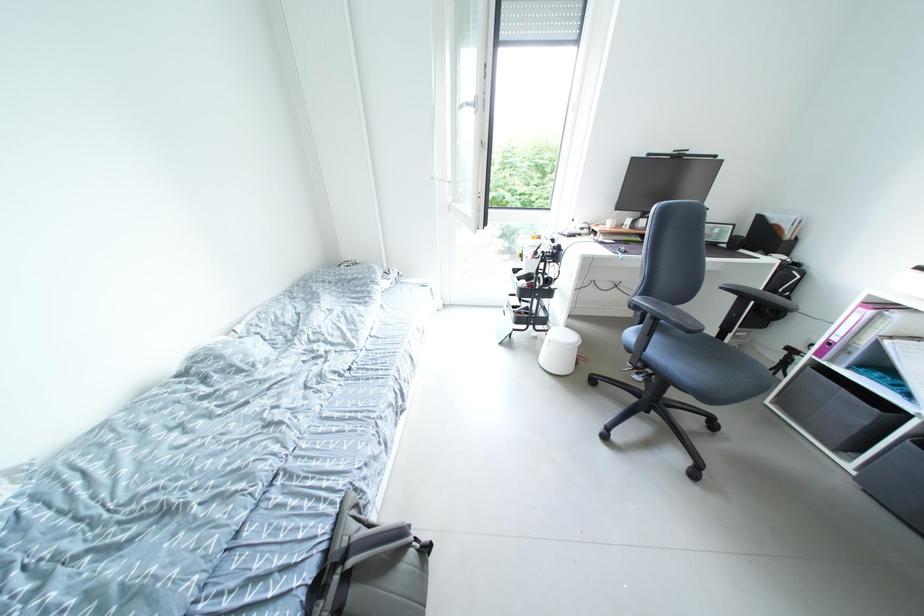
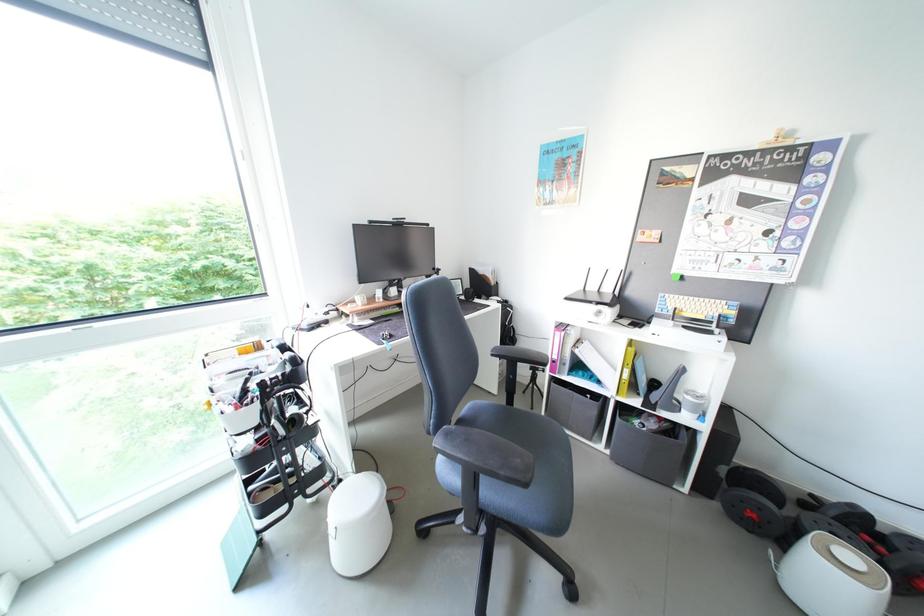
Question: The camera is either moving clockwise (left) or counter-clockwise (right) around the object. The first image is from the beginning of the video and the second image is from the end. Is the camera moving left or right when shooting the video?

Choices:
 (A) Left
 (B) Right

Answer: (A)